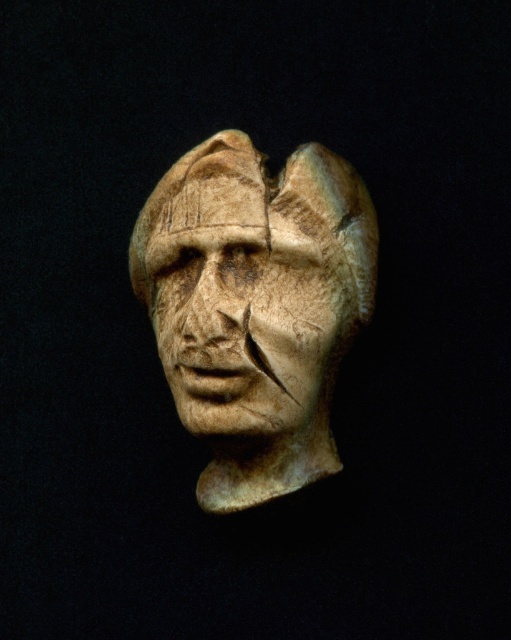
How much distance is there between beige stone head at center and carved stone face at center?

beige stone head at center is 0.52 inches away from carved stone face at center.

Does beige stone head at center have a smaller size compared to carved stone face at center?

No, beige stone head at center is not smaller than carved stone face at center.

Find the location of a particular element. The height and width of the screenshot is (640, 511). beige stone head at center is located at coordinates (256, 307).

This screenshot has height=640, width=511. In order to click on beige stone head at center in this screenshot , I will do `click(256, 307)`.